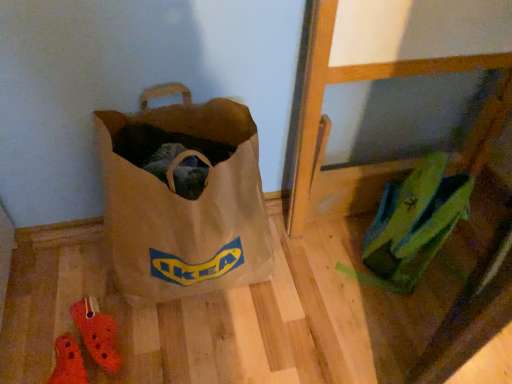
Question: From a real-world perspective, is brown canvas bag at lower left located beneath orange croc at lower left, the second footwear positioned from the bottom?

Choices:
 (A) no
 (B) yes

Answer: (A)

Question: Is brown canvas bag at lower left in front of orange croc at lower left, the 1th footwear viewed from the top?

Choices:
 (A) no
 (B) yes

Answer: (B)

Question: Does brown canvas bag at lower left have a greater width compared to orange croc at lower left, the 1th footwear viewed from the top?

Choices:
 (A) no
 (B) yes

Answer: (B)

Question: Can you confirm if brown canvas bag at lower left is thinner than orange croc at lower left, the 1th footwear viewed from the top?

Choices:
 (A) yes
 (B) no

Answer: (B)

Question: Does brown canvas bag at lower left appear on the right side of orange croc at lower left, the second footwear positioned from the bottom?

Choices:
 (A) yes
 (B) no

Answer: (A)

Question: Is the position of brown canvas bag at lower left more distant than that of orange croc at lower left, the second footwear positioned from the bottom?

Choices:
 (A) yes
 (B) no

Answer: (B)

Question: Is green fabric backpack at upper right further to camera compared to brown canvas bag at lower left?

Choices:
 (A) no
 (B) yes

Answer: (B)

Question: Does green fabric backpack at upper right have a greater height compared to brown canvas bag at lower left?

Choices:
 (A) no
 (B) yes

Answer: (A)

Question: Does green fabric backpack at upper right have a lesser width compared to brown canvas bag at lower left?

Choices:
 (A) no
 (B) yes

Answer: (B)

Question: Can you confirm if green fabric backpack at upper right is smaller than brown canvas bag at lower left?

Choices:
 (A) no
 (B) yes

Answer: (B)

Question: Considering the relative sizes of green fabric backpack at upper right and brown canvas bag at lower left in the image provided, is green fabric backpack at upper right shorter than brown canvas bag at lower left?

Choices:
 (A) yes
 (B) no

Answer: (A)

Question: Does green fabric backpack at upper right turn towards brown canvas bag at lower left?

Choices:
 (A) no
 (B) yes

Answer: (A)

Question: Does rubber crocs at lower left, which is counted as the 1th footwear, starting from the bottom, have a lesser width compared to brown canvas bag at lower left?

Choices:
 (A) yes
 (B) no

Answer: (A)